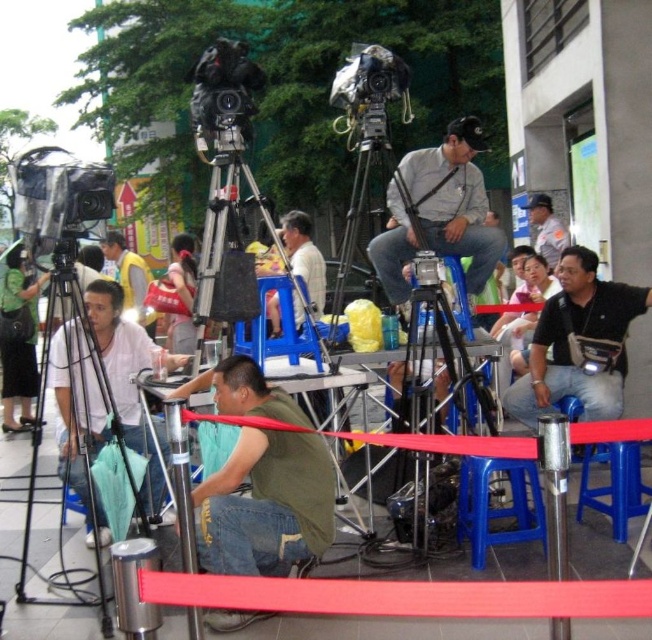
Who is taller, matte gray shirt at center or light brown leather jacket at center?

With more height is matte gray shirt at center.

Between point (464, 163) and point (115, 260), which one is positioned in front?

Point (464, 163) is in front.

Find the location of a particular element. matte gray shirt at center is located at coordinates click(454, 200).

From the picture: Can you confirm if matte white shirt at lower left is shorter than light blue shirt at center?

In fact, matte white shirt at lower left may be taller than light blue shirt at center.

Is matte white shirt at lower left to the right of light blue shirt at center from the viewer's perspective?

No, matte white shirt at lower left is not to the right of light blue shirt at center.

You are a GUI agent. You are given a task and a screenshot of the screen. Output one action in this format:
    pyautogui.click(x=<x>, y=<y>)
    Task: Click on the matte white shirt at lower left
    The height and width of the screenshot is (640, 652).
    Given the screenshot: What is the action you would take?
    pyautogui.click(x=128, y=378)

Who is more distant from viewer, (436, 195) or (554, 240)?

The point (554, 240) is behind.

Is point (415, 234) less distant than point (546, 214)?

That is True.

Where is `matte gray shirt at center`? The width and height of the screenshot is (652, 640). matte gray shirt at center is located at coordinates (454, 200).